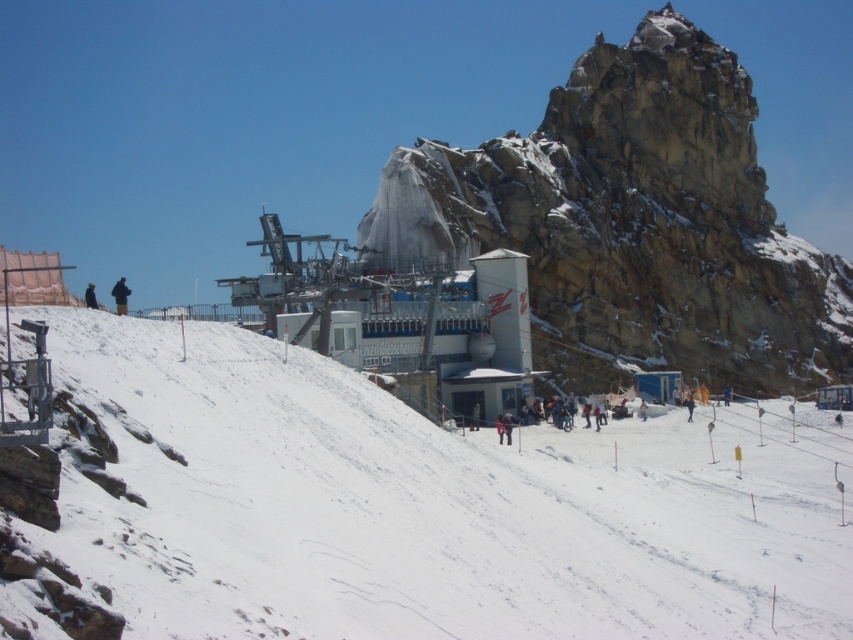
Question: Which point is farther to the camera?

Choices:
 (A) white snow at lower left
 (B) dark blue jacket at lower right
 (C) dark blue jacket at lower left
 (D) dark blue fabric at left

Answer: (B)

Question: Among these points, which one is nearest to the camera?

Choices:
 (A) (654, 264)
 (B) (117, 300)

Answer: (B)

Question: Is white snow at lower left behind dark blue jacket at lower right?

Choices:
 (A) yes
 (B) no

Answer: (B)

Question: Which point appears closest to the camera in this image?

Choices:
 (A) (354, 620)
 (B) (123, 282)

Answer: (A)

Question: Does dark blue fabric at left come behind dark blue jacket at lower right?

Choices:
 (A) yes
 (B) no

Answer: (B)

Question: Does white snow at lower left come behind rugged stone mountain at center?

Choices:
 (A) yes
 (B) no

Answer: (B)